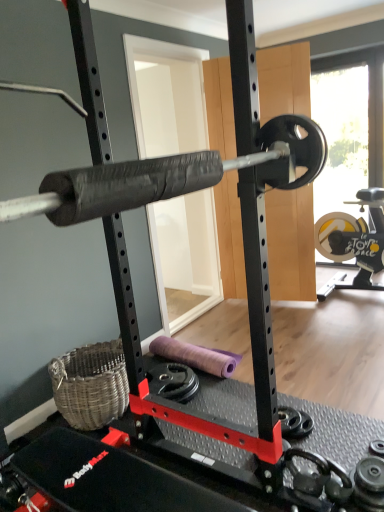
Where is `vacant space in front of black rubber dumbbell at lower right`? The image size is (384, 512). vacant space in front of black rubber dumbbell at lower right is located at coordinates (322, 448).